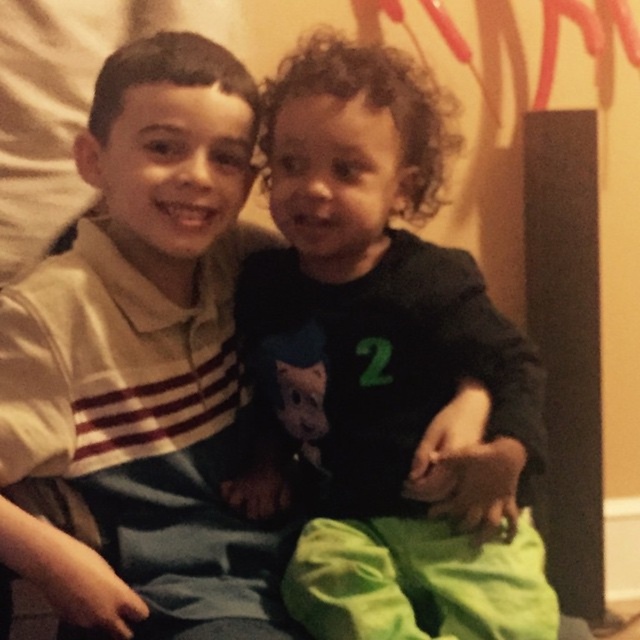
Question: Which point is closer to the camera taking this photo?

Choices:
 (A) (540, 397)
 (B) (104, 333)

Answer: (A)

Question: Which point is closer to the camera?

Choices:
 (A) dark green jersey at center
 (B) white striped shirt at left

Answer: (B)

Question: Which of the following is the farthest from the observer?

Choices:
 (A) white striped shirt at left
 (B) dark green jersey at center

Answer: (B)

Question: Can you confirm if dark green jersey at center is smaller than white striped shirt at left?

Choices:
 (A) no
 (B) yes

Answer: (B)

Question: Is dark green jersey at center wider than white striped shirt at left?

Choices:
 (A) yes
 (B) no

Answer: (A)

Question: Observing the image, what is the correct spatial positioning of dark green jersey at center in reference to white striped shirt at left?

Choices:
 (A) above
 (B) below

Answer: (A)